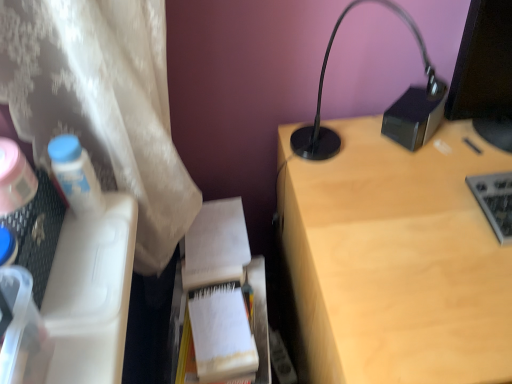
Identify the location of free space above white paper at center (from a real-world perspective). (217, 320).